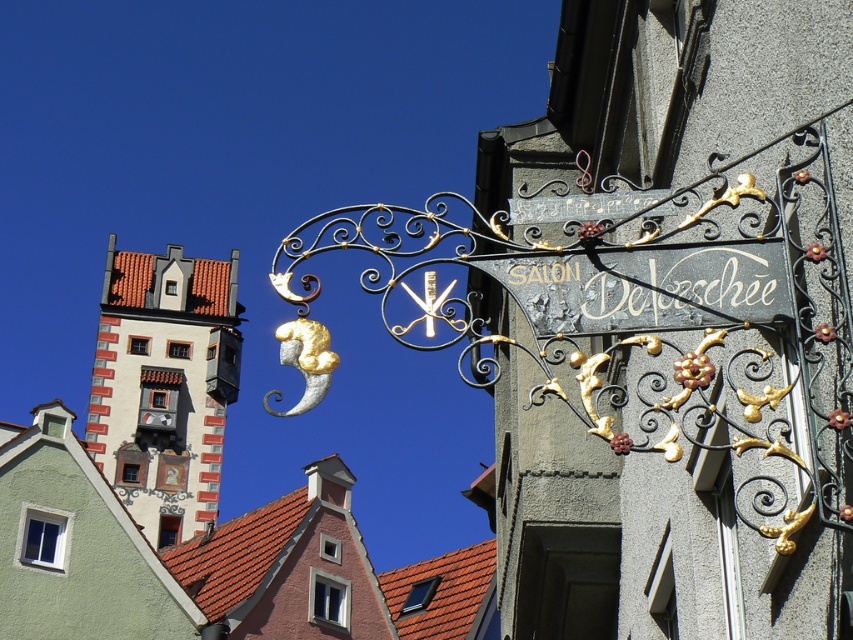
Question: Does white painted building at upper left have a lesser width compared to black wrought iron sign at upper center?

Choices:
 (A) yes
 (B) no

Answer: (B)

Question: Does polished metal sign at center have a lesser width compared to black wrought iron sign at upper center?

Choices:
 (A) yes
 (B) no

Answer: (B)

Question: Which object is closer to the camera taking this photo?

Choices:
 (A) black wrought iron sign at upper center
 (B) white painted building at upper left
 (C) polished metal sign at center

Answer: (C)

Question: In this image, where is polished metal sign at center located relative to white painted building at upper left?

Choices:
 (A) below
 (B) above

Answer: (B)

Question: Which point is farther from the camera taking this photo?

Choices:
 (A) (4, 428)
 (B) (532, 324)

Answer: (A)

Question: Which object appears farthest from the camera in this image?

Choices:
 (A) white painted building at upper left
 (B) black wrought iron sign at upper center
 (C) polished metal sign at center

Answer: (A)